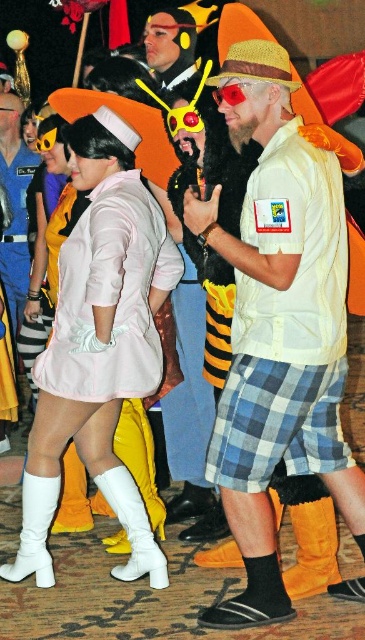
You are a photographer at the event and need to capture a closeup of both the white matte boots at lower left and orange suede boot at lower left. Which boot should you zoom in on first to ensure both are in frame?

The white matte boots at lower left is bigger than orange suede boot at lower left, so you should zoom in on the white matte boots at lower left first to accommodate its larger size before adjusting for the smaller orange suede boot at lower left.

You are an event photographer at the Comic Con event. You need to take a photo of the matte white shirt at center and the shiny plastic helmet at center. According to the scene description, which object is positioned to the right of the other?

The matte white shirt at center is to the right of the shiny plastic helmet at center.